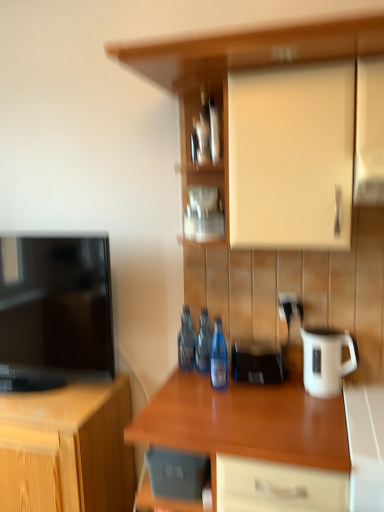
Question: Is white glossy jug at right behind white glossy counter at lower right?

Choices:
 (A) no
 (B) yes

Answer: (B)

Question: Is white glossy jug at right thinner than white glossy counter at lower right?

Choices:
 (A) no
 (B) yes

Answer: (B)

Question: Is white glossy jug at right to the right of white glossy counter at lower right from the viewer's perspective?

Choices:
 (A) no
 (B) yes

Answer: (A)

Question: From a real-world perspective, is white glossy jug at right positioned under white glossy counter at lower right based on gravity?

Choices:
 (A) yes
 (B) no

Answer: (B)

Question: Is white glossy counter at lower right surrounded by white glossy jug at right?

Choices:
 (A) no
 (B) yes

Answer: (A)

Question: Visually, is blue glass bottle at center, the third bottle in the back-to-front sequence, positioned to the left or to the right of wooden cabinet at left, which is counted as the 1th cabinetry, starting from the left?

Choices:
 (A) left
 (B) right

Answer: (B)

Question: In terms of width, does blue glass bottle at center, which ranks as the 1th bottle in front-to-back order, look wider or thinner when compared to wooden cabinet at left, which is counted as the 1th cabinetry, starting from the left?

Choices:
 (A) thin
 (B) wide

Answer: (A)

Question: From the image's perspective, relative to wooden cabinet at left, which appears as the second cabinetry when viewed from the top, is blue glass bottle at center, which ranks as the 1th bottle in front-to-back order, above or below?

Choices:
 (A) below
 (B) above

Answer: (B)

Question: From a real-world perspective, is blue glass bottle at center, which ranks as the 1th bottle in front-to-back order, physically located above or below wooden cabinet at left, which appears as the first cabinetry when ordered from the bottom?

Choices:
 (A) above
 (B) below

Answer: (A)

Question: In the image, is metallic silver bottle at center, the first bottle viewed from the back, positioned in front of or behind black plastic phone at center?

Choices:
 (A) behind
 (B) front

Answer: (A)

Question: Is metallic silver bottle at center, the 3th bottle viewed from the front, to the left or to the right of black plastic phone at center in the image?

Choices:
 (A) right
 (B) left

Answer: (B)

Question: Based on their sizes in the image, would you say metallic silver bottle at center, the 3th bottle viewed from the front, is bigger or smaller than black plastic phone at center?

Choices:
 (A) small
 (B) big

Answer: (A)

Question: From the image's perspective, is metallic silver bottle at center, the first bottle viewed from the back, above or below black plastic phone at center?

Choices:
 (A) above
 (B) below

Answer: (A)

Question: Considering the relative positions of black glossy television at left and metallic silver frame at center, the 1th shelf in the back-to-front sequence, in the image provided, is black glossy television at left to the left or to the right of metallic silver frame at center, the 1th shelf in the back-to-front sequence,?

Choices:
 (A) left
 (B) right

Answer: (A)

Question: Is black glossy television at left taller or shorter than metallic silver frame at center, the 1th shelf in the back-to-front sequence?

Choices:
 (A) short
 (B) tall

Answer: (B)